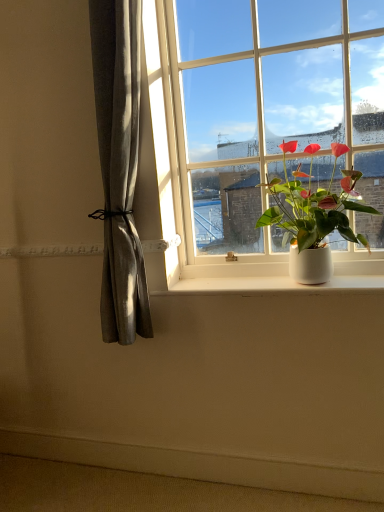
Question: Is white smooth window sill at lower center wider or thinner than white glossy window at upper center?

Choices:
 (A) thin
 (B) wide

Answer: (A)

Question: Considering the positions of point 231,287 and point 183,166, is point 231,287 closer or farther from the camera than point 183,166?

Choices:
 (A) farther
 (B) closer

Answer: (B)

Question: Which of these objects is positioned farthest from the green matte plant at right?

Choices:
 (A) white smooth window sill at lower center
 (B) white smooth ledge at lower center
 (C) white glossy window at upper center

Answer: (B)

Question: Which of these objects is positioned closest to the white glossy window at upper center?

Choices:
 (A) white smooth ledge at lower center
 (B) white smooth window sill at lower center
 (C) green matte plant at right

Answer: (C)